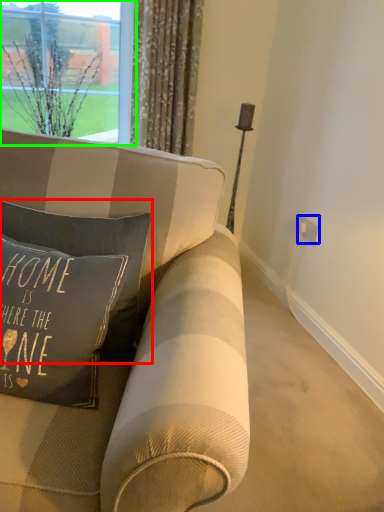
Question: Which is nearer to the pillow (highlighted by a red box)? electric outlet (highlighted by a blue box) or window (highlighted by a green box).

Choices:
 (A) electric outlet
 (B) window

Answer: (B)